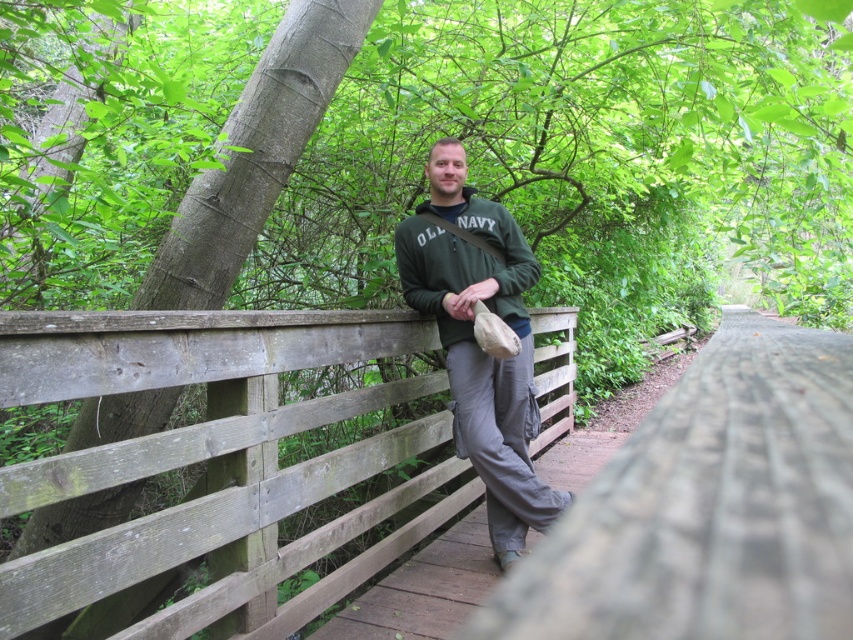
This screenshot has height=640, width=853. What do you see at coordinates (476, 340) in the screenshot? I see `dark green fleece at center` at bounding box center [476, 340].

Describe the element at coordinates (476, 340) in the screenshot. I see `dark green fleece at center` at that location.

Find the location of `dark green fleece at center`. dark green fleece at center is located at coordinates (476, 340).

Does point (374, 602) come behind point (476, 230)?

No, (374, 602) is in front of (476, 230).

Which is behind, point (341, 614) or point (457, 221)?

Point (457, 221)

You are a GUI agent. You are given a task and a screenshot of the screen. Output one action in this format:
    pyautogui.click(x=<x>, y=<y>)
    Task: Click on the brown wooden path at center
    Image resolution: width=853 pixels, height=640 pixels.
    Given the screenshot: What is the action you would take?
    pyautogui.click(x=422, y=589)

What do you see at coordinates (476, 340) in the screenshot?
I see `dark green fleece at center` at bounding box center [476, 340].

How far apart are dark green fleece at center and green fleece sweatshirt at center?

dark green fleece at center and green fleece sweatshirt at center are 4.65 inches apart from each other.

Looking at this image, who is more forward, (434, 204) or (439, 308)?

Positioned in front is point (439, 308).

Identify the location of dark green fleece at center. (476, 340).